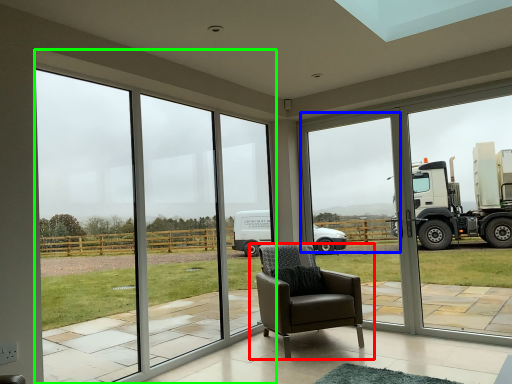
Question: Considering the real-world distances, which object is farthest from chair (highlighted by a red box)? window screen (highlighted by a blue box) or window (highlighted by a green box)?

Choices:
 (A) window screen
 (B) window

Answer: (A)